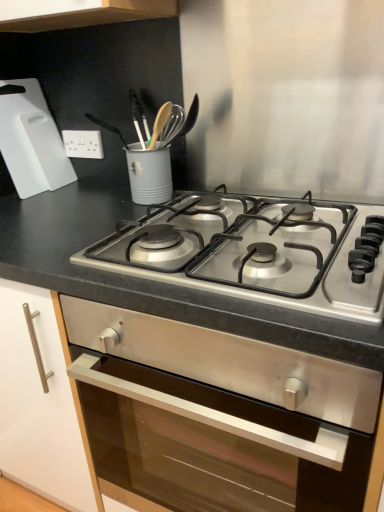
Question: Considering the relative sizes of white plastic cutting board at upper left and stainless steel gas stove at center in the image provided, is white plastic cutting board at upper left shorter than stainless steel gas stove at center?

Choices:
 (A) no
 (B) yes

Answer: (A)

Question: Is stainless steel gas stove at center inside white plastic cutting board at upper left?

Choices:
 (A) yes
 (B) no

Answer: (B)

Question: Can you confirm if white plastic cutting board at upper left is thinner than stainless steel gas stove at center?

Choices:
 (A) yes
 (B) no

Answer: (A)

Question: Is white plastic cutting board at upper left not inside stainless steel gas stove at center?

Choices:
 (A) yes
 (B) no

Answer: (A)

Question: Is white plastic cutting board at upper left at the right side of stainless steel gas stove at center?

Choices:
 (A) yes
 (B) no

Answer: (B)

Question: From a real-world perspective, is white plastic cutting board at upper left positioned under stainless steel gas stove at center based on gravity?

Choices:
 (A) no
 (B) yes

Answer: (A)

Question: Does white plastic electric outlet at upper left appear on the right side of slate gray countertop at center?

Choices:
 (A) no
 (B) yes

Answer: (A)

Question: Does white plastic electric outlet at upper left appear on the left side of slate gray countertop at center?

Choices:
 (A) no
 (B) yes

Answer: (B)

Question: Is slate gray countertop at center at the back of white plastic electric outlet at upper left?

Choices:
 (A) no
 (B) yes

Answer: (A)

Question: Does white plastic electric outlet at upper left touch slate gray countertop at center?

Choices:
 (A) no
 (B) yes

Answer: (A)

Question: Is the position of white plastic electric outlet at upper left less distant than that of slate gray countertop at center?

Choices:
 (A) no
 (B) yes

Answer: (A)

Question: Would you say white plastic electric outlet at upper left contains slate gray countertop at center?

Choices:
 (A) yes
 (B) no

Answer: (B)

Question: From a real-world perspective, is slate gray countertop at center on white plastic electric outlet at upper left?

Choices:
 (A) yes
 (B) no

Answer: (B)